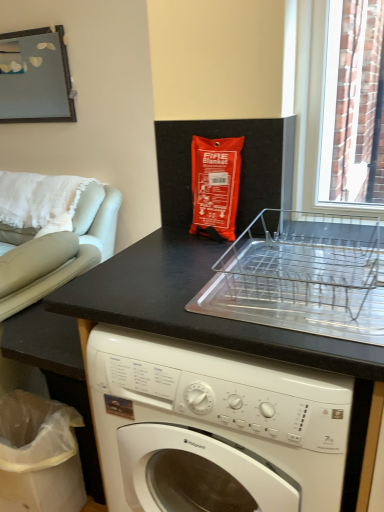
What are the coordinates of `free space above black matte counter at lower left (from a real-world perspective)` in the screenshot? It's located at (207, 278).